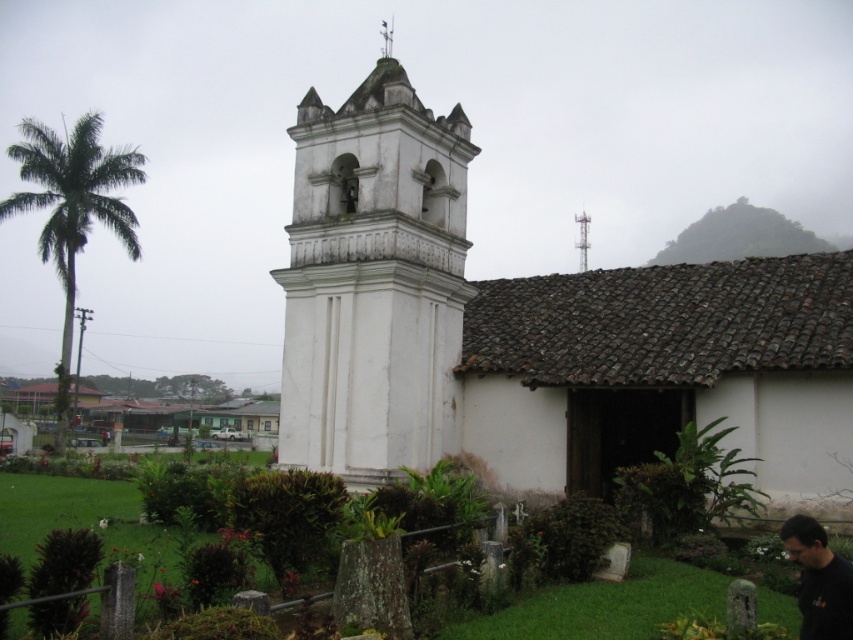
Question: Where is white stone bell tower at center located in relation to black matte shirt at lower right in the image?

Choices:
 (A) above
 (B) below

Answer: (A)

Question: Which object appears farthest from the camera in this image?

Choices:
 (A) black matte shirt at lower right
 (B) white stucco church at center

Answer: (B)

Question: Considering the real-world distances, which object is farthest from the white stucco church at center?

Choices:
 (A) white stone bell tower at center
 (B) green leafy palm at left

Answer: (B)

Question: Does white stucco church at center come in front of black matte shirt at lower right?

Choices:
 (A) yes
 (B) no

Answer: (B)

Question: In this image, where is white stone bell tower at center located relative to black matte shirt at lower right?

Choices:
 (A) below
 (B) above

Answer: (B)

Question: Which of the following is the farthest from the observer?

Choices:
 (A) green leafy palm at left
 (B) black matte shirt at lower right
 (C) white stone bell tower at center

Answer: (A)